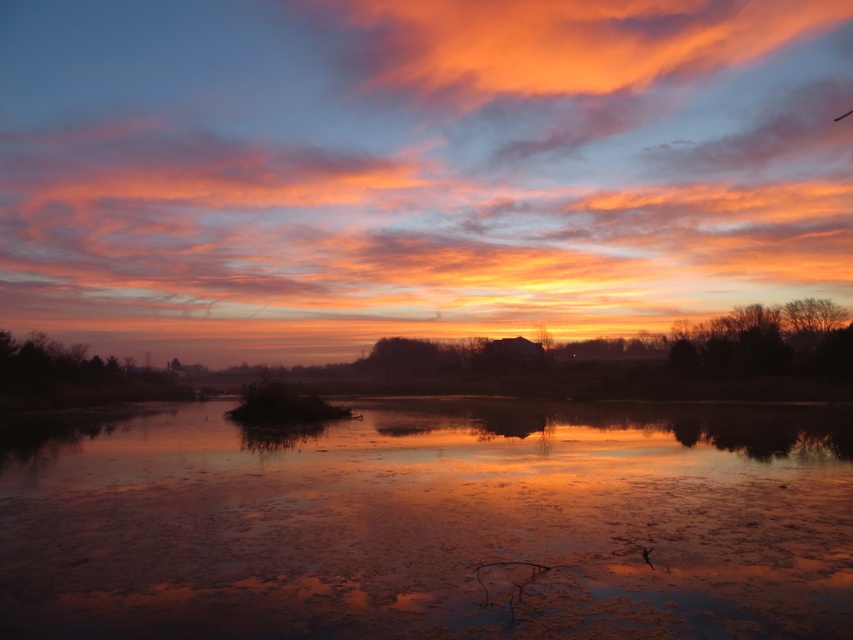
You are an astronomer observing the sunset and notice a point in the sky at coordinates point (415, 170). What object is located at that specific coordinate?

The point (415, 170) marks the location of the matte orange cloud at upper center.